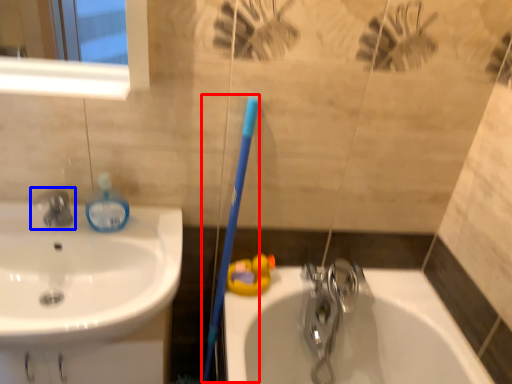
Question: Which point is closer to the camera, toothbrush (highlighted by a red box) or tap (highlighted by a blue box)?

Choices:
 (A) toothbrush
 (B) tap

Answer: (A)